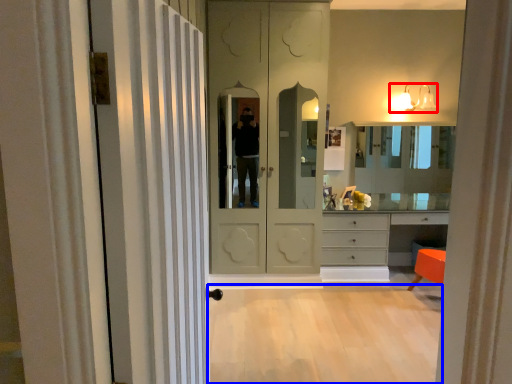
Question: Among these objects, which one is farthest to the camera, light fixture (highlighted by a red box) or plain (highlighted by a blue box)?

Choices:
 (A) light fixture
 (B) plain

Answer: (A)